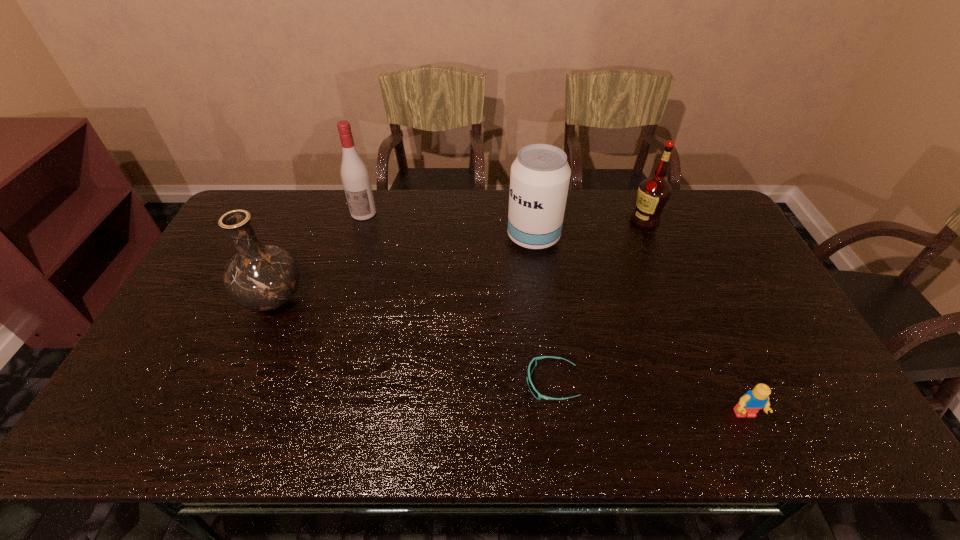
You are a GUI agent. You are given a task and a screenshot of the screen. Output one action in this format:
    pyautogui.click(x=<x>, y=<y>)
    Task: Click on the vacant region located 0.130m on the label of the rightmost alcohol
    
    Given the screenshot: What is the action you would take?
    pyautogui.click(x=592, y=221)

Identify the location of vacant area located 0.390m on the label of the rightmost alcohol. (516, 221).

The height and width of the screenshot is (540, 960). In order to click on vacant region located 0.170m on the label of the rightmost alcohol in this screenshot , I will do `click(580, 221)`.

The height and width of the screenshot is (540, 960). Find the location of `free space located on the front of the second alcohol from left to right`. free space located on the front of the second alcohol from left to right is located at coordinates click(542, 308).

What are the coordinates of `vacant space situated on the left of the leftmost object` in the screenshot? It's located at pyautogui.click(x=196, y=299).

At what (x,y) coordinates should I click in order to perform the action: click on vacant space situated 0.060m on the front-facing side of the shortest object. Please return your answer as a coordinate pair (x, y). The image size is (960, 540). Looking at the image, I should click on (501, 383).

Locate an element on the screen. free region located on the front-facing side of the shortest object is located at coordinates (481, 383).

Where is `vacant space located on the front-facing side of the shortest object`? This screenshot has width=960, height=540. vacant space located on the front-facing side of the shortest object is located at coordinates (452, 383).

Image resolution: width=960 pixels, height=540 pixels. I want to click on object that is positioned at the near edge, so click(x=750, y=403).

Find the location of `object present at the left edge`. object present at the left edge is located at coordinates [x=261, y=277].